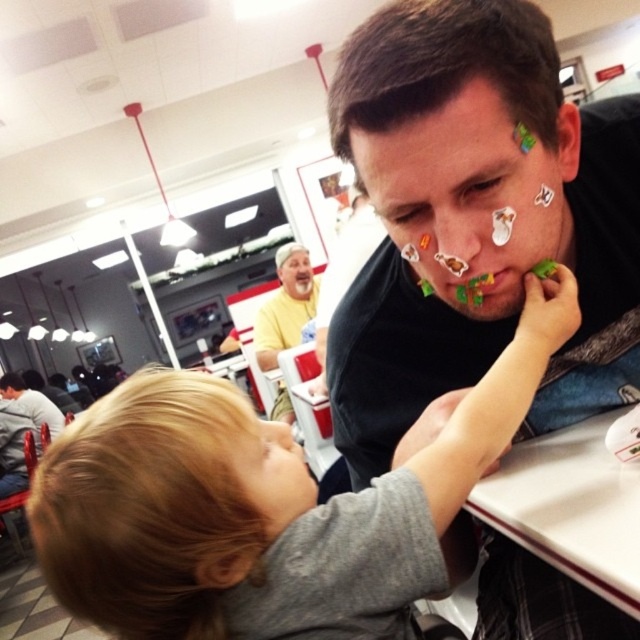
Is the position of matte brown hair at center less distant than that of yellow matte shirt at upper center?

That is True.

Is matte brown hair at center above yellow matte shirt at upper center?

Yes.

Which is behind, point (460, 120) or point (268, 305)?

Positioned behind is point (268, 305).

I want to click on matte brown hair at center, so [x=429, y=132].

Between point (237, 556) and point (8, 396), which one is positioned behind?

Point (8, 396)

This screenshot has width=640, height=640. What are the coordinates of `blonde hair at center` in the screenshot? It's located at (260, 506).

I want to click on blonde hair at center, so click(x=260, y=506).

Where is `blonde hair at center`? Image resolution: width=640 pixels, height=640 pixels. blonde hair at center is located at coordinates (260, 506).

Between matte black shirt at center and green matte stickers at mouth center, which one has less height?

Standing shorter between the two is green matte stickers at mouth center.

Does point (472, 209) lie in front of point (488, 276)?

Yes, point (472, 209) is closer to viewer.

Is point (472, 232) farther from viewer compared to point (483, 276)?

No, (472, 232) is in front of (483, 276).

You are a GUI agent. You are given a task and a screenshot of the screen. Output one action in this format:
    pyautogui.click(x=<x>, y=<y>)
    Task: Click on the matte black shirt at center
    This screenshot has width=640, height=640.
    Given the screenshot: What is the action you would take?
    pyautogui.click(x=476, y=220)